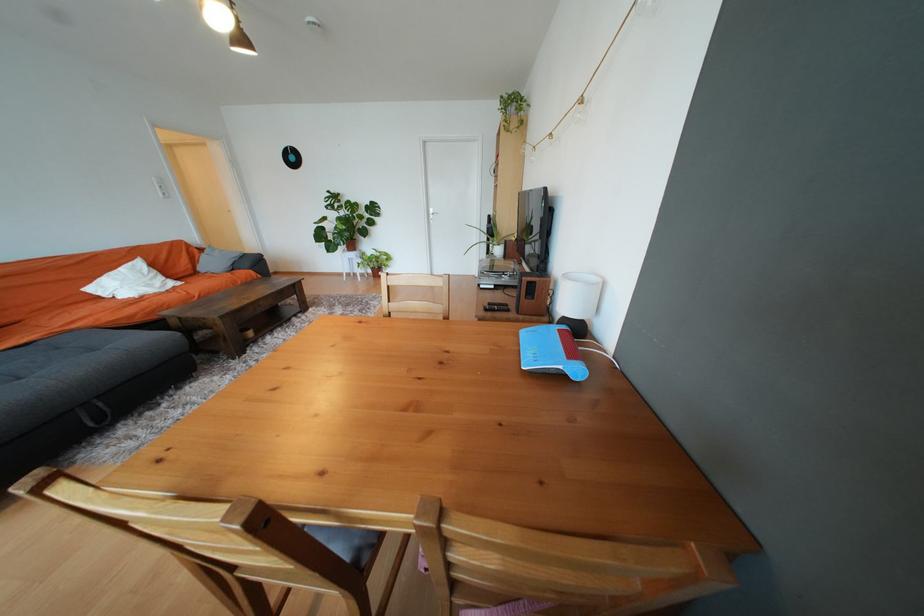
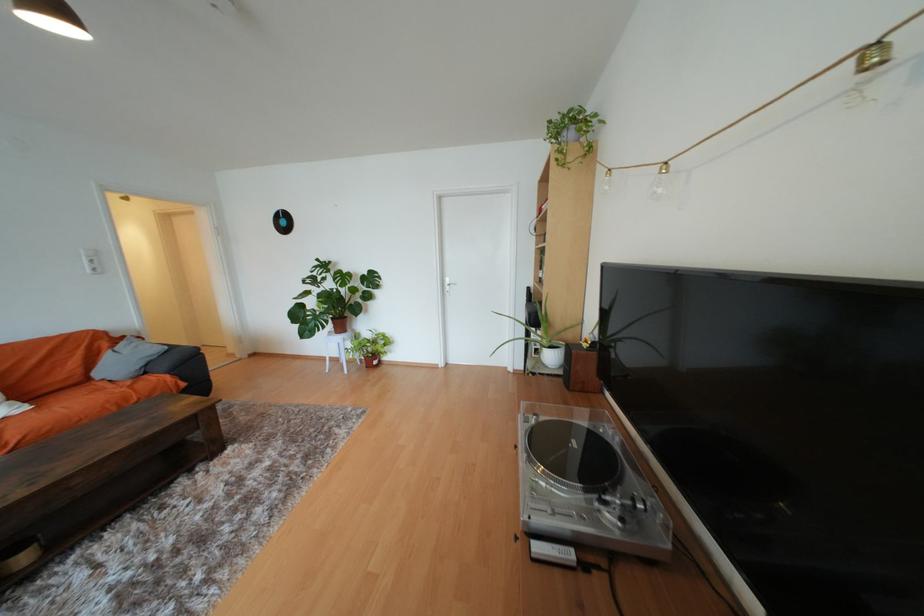
Question: The images are taken continuously from a first-person perspective. In which direction are you moving?

Choices:
 (A) Left
 (B) Right
 (C) Forward
 (D) Backward

Answer: (C)